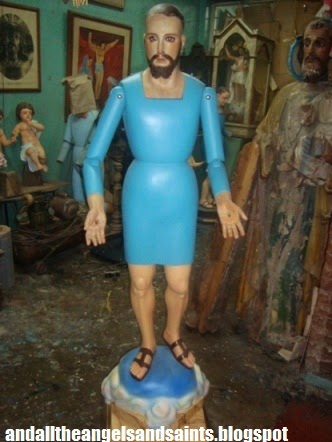
What are the coordinates of `window` in the screenshot? It's located at (220, 23).